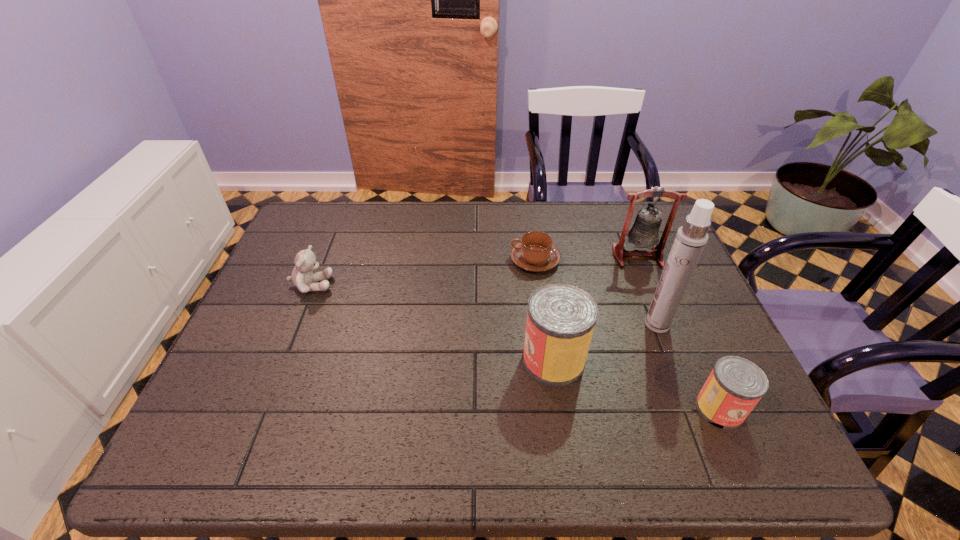
I want to click on the fifth farthest object, so click(561, 317).

What are the coordinates of `the fourth shortest object` in the screenshot? It's located at (561, 317).

You are a GUI agent. You are given a task and a screenshot of the screen. Output one action in this format:
    pyautogui.click(x=<x>, y=<y>)
    Task: Click on the nearest object
    This screenshot has width=960, height=540.
    Given the screenshot: What is the action you would take?
    pyautogui.click(x=734, y=387)

This screenshot has width=960, height=540. What are the coordinates of `the right can` in the screenshot? It's located at (734, 387).

Where is `bell`? bell is located at coordinates (644, 233).

Locate an element on the screen. teddy bear is located at coordinates (303, 278).

The image size is (960, 540). What are the coordinates of `the shortest object` in the screenshot? It's located at (535, 252).

Identify the location of the tallest object. The width and height of the screenshot is (960, 540). pyautogui.click(x=691, y=238).

Locate an element on the screen. the fourth farthest object is located at coordinates pos(691,238).

At what (x,y) coordinates should I click in order to perform the action: click on free location located on the right of the taller can. Please return your answer as a coordinate pair (x, y). The image size is (960, 540). Looking at the image, I should click on (679, 360).